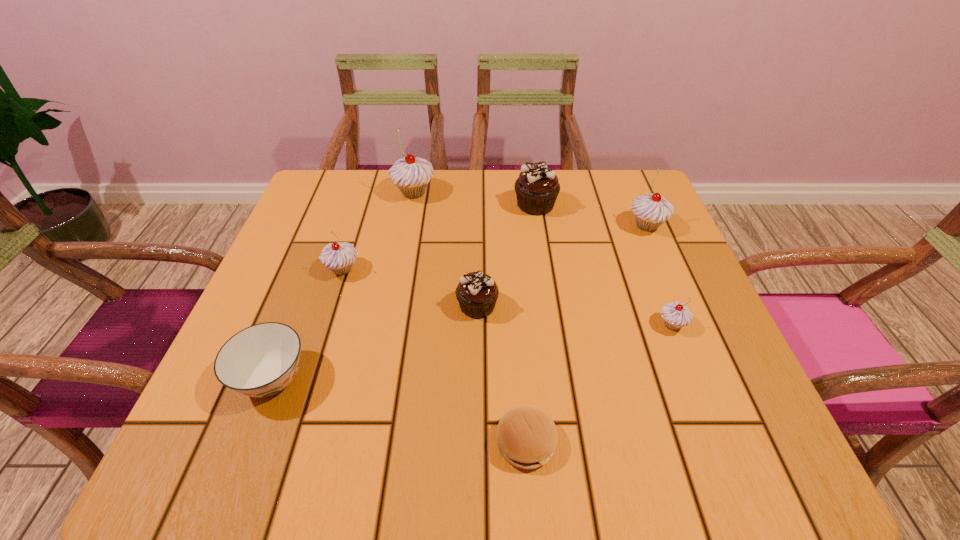
Where is `free spot between the left brown cupcake and the shortest object`? Image resolution: width=960 pixels, height=540 pixels. free spot between the left brown cupcake and the shortest object is located at coordinates (501, 374).

Where is `vacant area that lies between the fifth shortest cupcake and the patty`? vacant area that lies between the fifth shortest cupcake and the patty is located at coordinates (587, 334).

Locate an element on the screen. free space between the smallest gray cupcake and the fifth shortest cupcake is located at coordinates (660, 275).

Identify which object is located as the fourth nearest to the nearer brown cupcake. Please provide its 2D coordinates. Your answer should be formatted as a tuple, i.e. [(x, y)], where the tuple contains the x and y coordinates of a point satisfying the conditions above.

[(261, 360)]

Choose which object is the fifth nearest neighbor to the patty. Please provide its 2D coordinates. Your answer should be formatted as a tuple, i.e. [(x, y)], where the tuple contains the x and y coordinates of a point satisfying the conditions above.

[(651, 210)]

Locate an element on the screen. This screenshot has height=540, width=960. cupcake identified as the fourth closest to the seventh tallest object is located at coordinates (537, 187).

I want to click on cupcake that stands as the third closest to the smaller brown cupcake, so click(411, 175).

The image size is (960, 540). Identify the location of gray cupcake that is the third closest one to the second shortest object. (675, 314).

Select which gray cupcake appears as the third closest to the second nearest gray cupcake. Please provide its 2D coordinates. Your answer should be formatted as a tuple, i.e. [(x, y)], where the tuple contains the x and y coordinates of a point satisfying the conditions above.

[(651, 210)]

Locate an element on the screen. The width and height of the screenshot is (960, 540). vacant region that satisfies the following two spatial constraints: 1. on the back side of the fourth farthest cupcake; 2. on the right side of the second tallest cupcake is located at coordinates (356, 226).